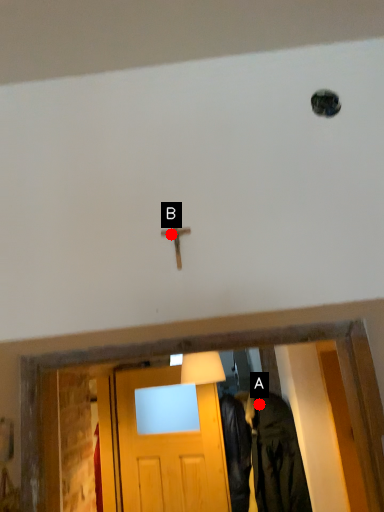
Question: Two points are circled on the image, labeled by A and B beside each circle. Which point appears closest to the camera in this image?

Choices:
 (A) A is closer
 (B) B is closer

Answer: (B)